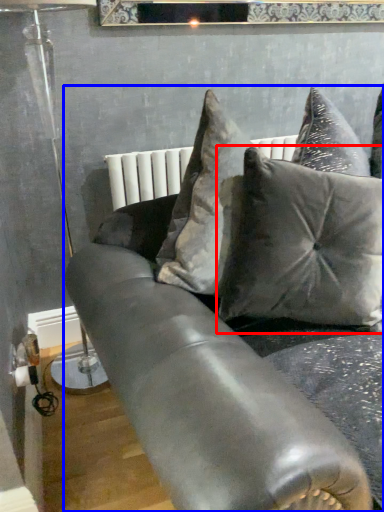
Question: Which object appears closest to the camera in this image, pillow (highlighted by a red box) or studio couch (highlighted by a blue box)?

Choices:
 (A) pillow
 (B) studio couch

Answer: (B)